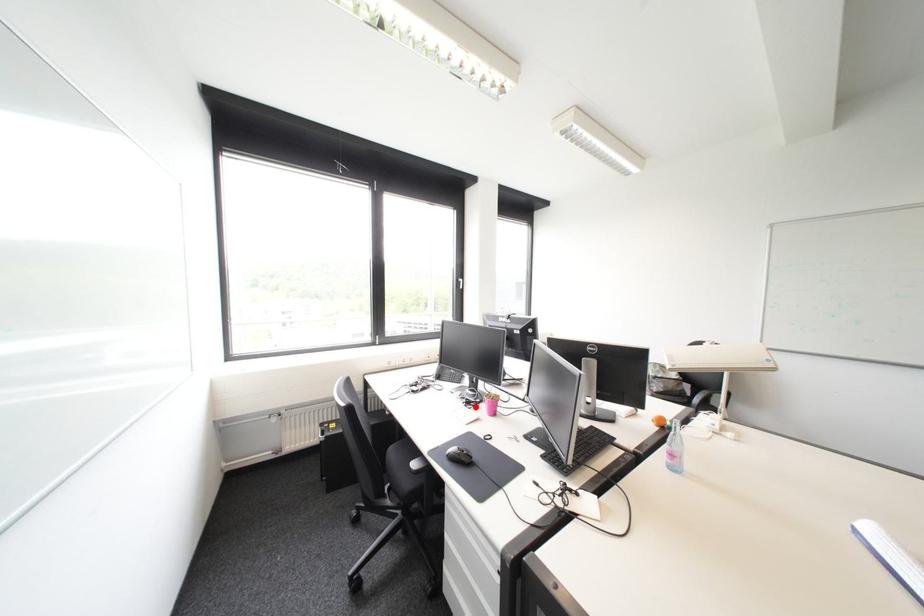
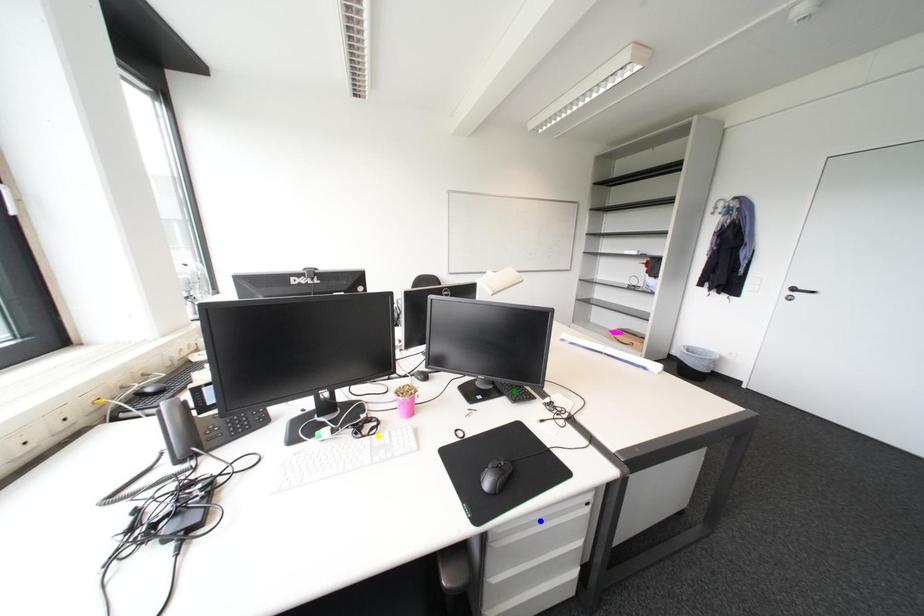
Question: I am providing you with two images of the same scene from different viewpoints. A red point is marked on the first image. You are given multiple points on the second image. Which point in image 2 represents the same 3d spot as the red point in image 1?

Choices:
 (A) green point
 (B) yellow point
 (C) blue point

Answer: (B)